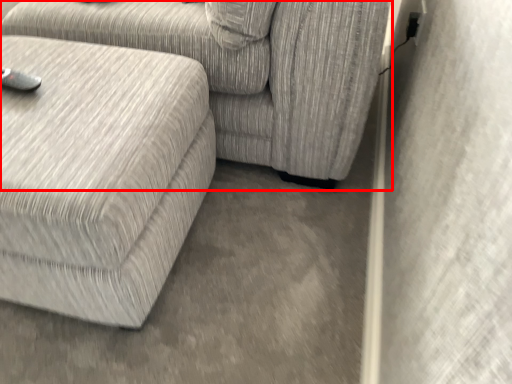
Question: In this image, where is studio couch (annotated by the red box) located relative to studio couch?

Choices:
 (A) right
 (B) left

Answer: (B)